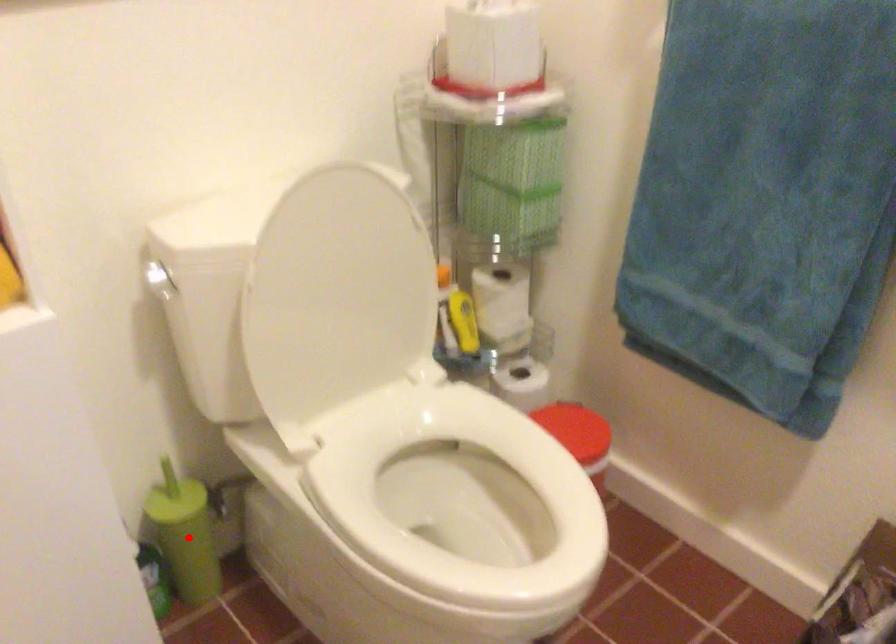
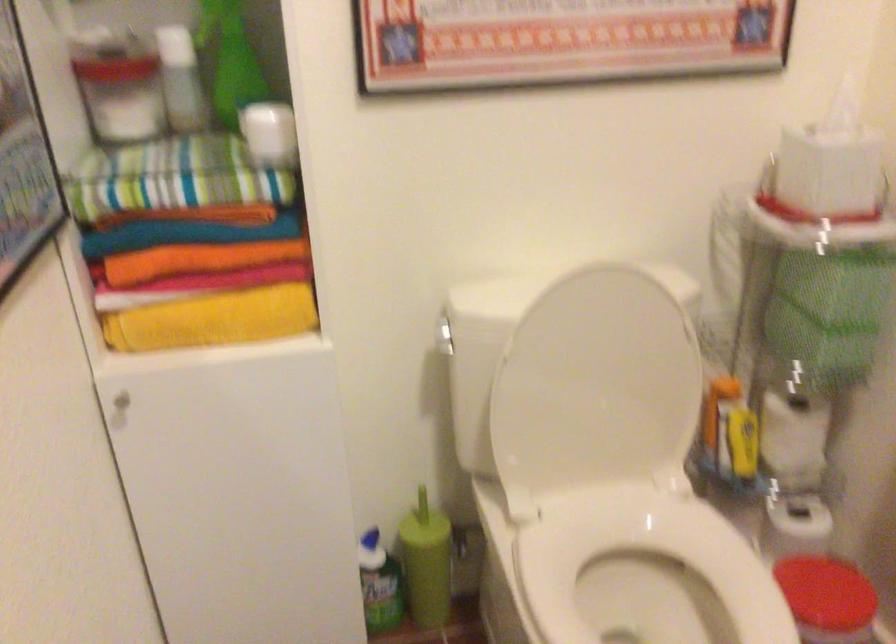
Find the pixel in the second image that matches the highlighted location in the first image.

(426, 563)